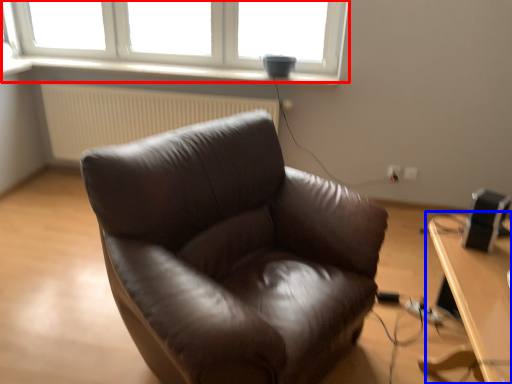
Question: Which of the following is the farthest to the observer, window (highlighted by a red box) or table (highlighted by a blue box)?

Choices:
 (A) window
 (B) table

Answer: (A)